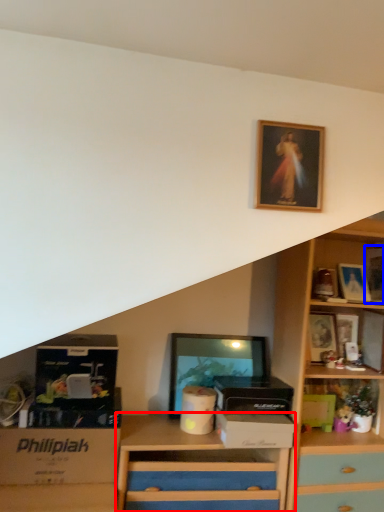
Question: Which object is closer to the camera taking this photo, chest of drawers (highlighted by a red box) or picture frame (highlighted by a blue box)?

Choices:
 (A) chest of drawers
 (B) picture frame

Answer: (A)